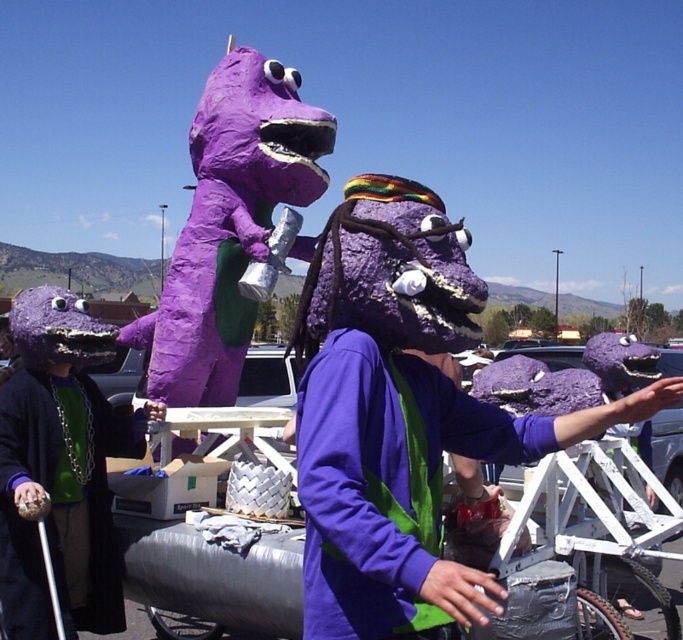
Question: Is purple papier-mâché mask at center positioned behind matte purple costume at left?

Choices:
 (A) no
 (B) yes

Answer: (A)

Question: Which of the following is the farthest from the observer?

Choices:
 (A) (350, 364)
 (B) (68, 403)

Answer: (B)

Question: Does purple papier-mâché mask at center appear over matte purple costume at left?

Choices:
 (A) yes
 (B) no

Answer: (A)

Question: Is purple papier-mâché mask at center further to camera compared to matte purple costume at left?

Choices:
 (A) yes
 (B) no

Answer: (B)

Question: Which object is farther from the camera taking this photo?

Choices:
 (A) matte purple costume at left
 (B) purple papier-mâché mask at center

Answer: (A)